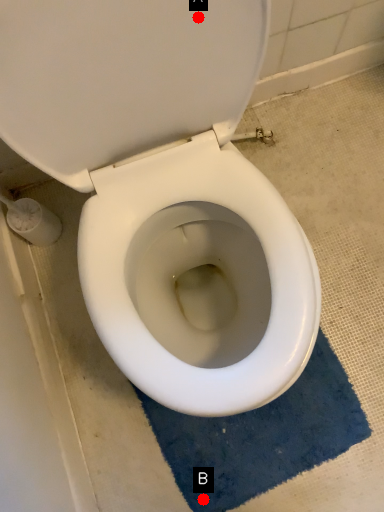
Question: Two points are circled on the image, labeled by A and B beside each circle. Which point appears farthest from the camera in this image?

Choices:
 (A) A is further
 (B) B is further

Answer: (B)